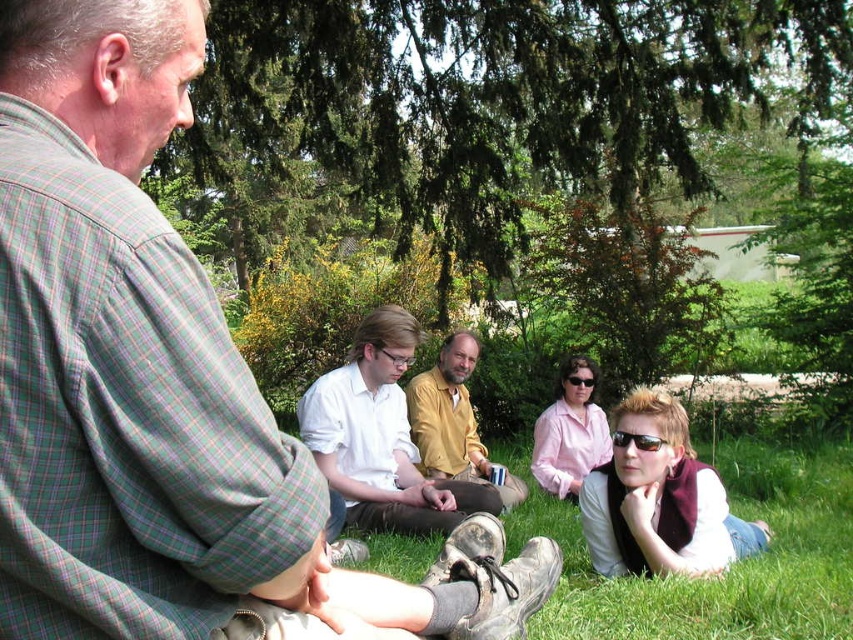
Which of these two, green grass at lower center or white shirt at center, stands taller?

Standing taller between the two is white shirt at center.

Between green grass at lower center and white shirt at center, which one appears on the right side from the viewer's perspective?

green grass at lower center is more to the right.

Locate an element on the screen. green grass at lower center is located at coordinates (730, 568).

Where is `green grass at lower center`? The image size is (853, 640). green grass at lower center is located at coordinates (730, 568).

Between green grass at lower center and black plastic sunglasses at lower center, which one has more height?

green grass at lower center is taller.

Can you confirm if green grass at lower center is taller than black plastic sunglasses at lower center?

Yes, green grass at lower center is taller than black plastic sunglasses at lower center.

Is point (392, 568) farther from viewer compared to point (639, 445)?

Yes, it is behind point (639, 445).

Identify the location of green grass at lower center. (730, 568).

Who is more distant from viewer, (795,532) or (408,365)?

The point (408,365) is more distant.

Is green grass at lower center wider than clear plastic glasses at center?

Yes, green grass at lower center is wider than clear plastic glasses at center.

At what (x,y) coordinates should I click in order to perform the action: click on green grass at lower center. Please return your answer as a coordinate pair (x, y). Image resolution: width=853 pixels, height=640 pixels. Looking at the image, I should click on 730,568.